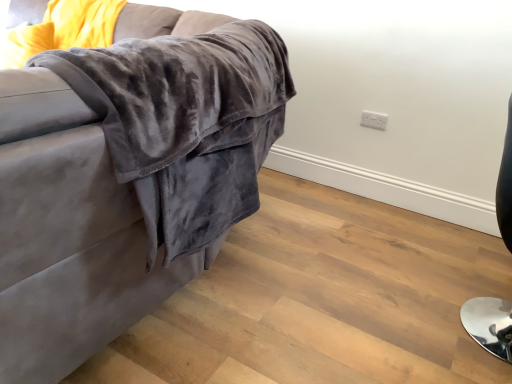
Identify the location of free space to the back side of shiny black chair at right. (422, 259).